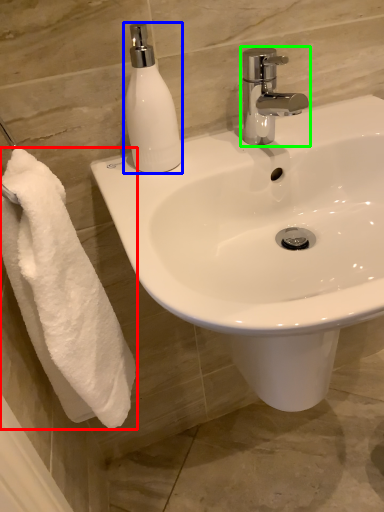
Question: Based on their relative distances, which object is nearer to towel (highlighted by a red box)? Choose from soap dispenser (highlighted by a blue box) and tap (highlighted by a green box).

Choices:
 (A) soap dispenser
 (B) tap

Answer: (A)